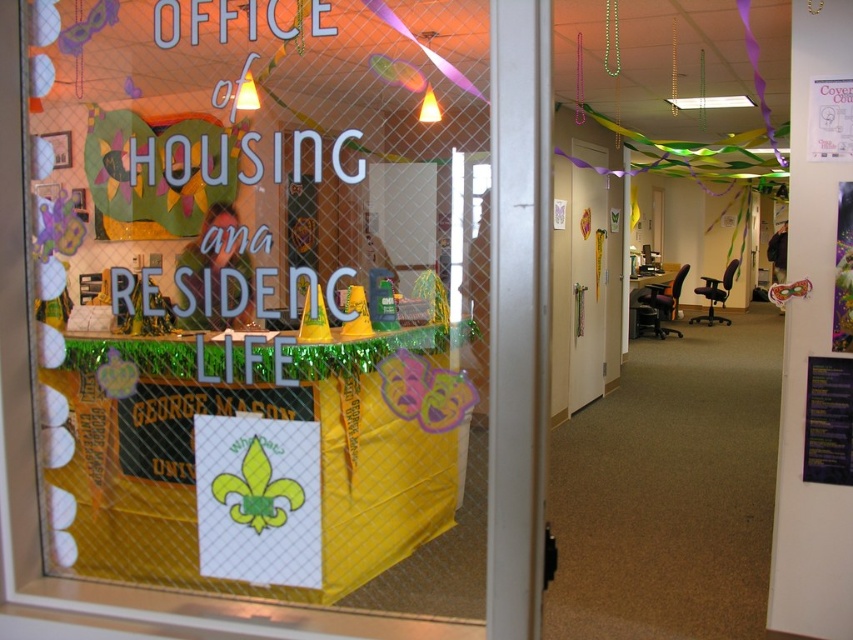
Question: Is the position of yellow fabric at center more distant than that of white glossy door at center?

Choices:
 (A) yes
 (B) no

Answer: (B)

Question: Which point is farther to the camera?

Choices:
 (A) white glossy door at center
 (B) yellow fabric at center

Answer: (A)

Question: Is yellow fabric at center to the left of white glossy door at center from the viewer's perspective?

Choices:
 (A) no
 (B) yes

Answer: (B)

Question: Is yellow fabric at center to the right of white glossy door at center from the viewer's perspective?

Choices:
 (A) yes
 (B) no

Answer: (B)